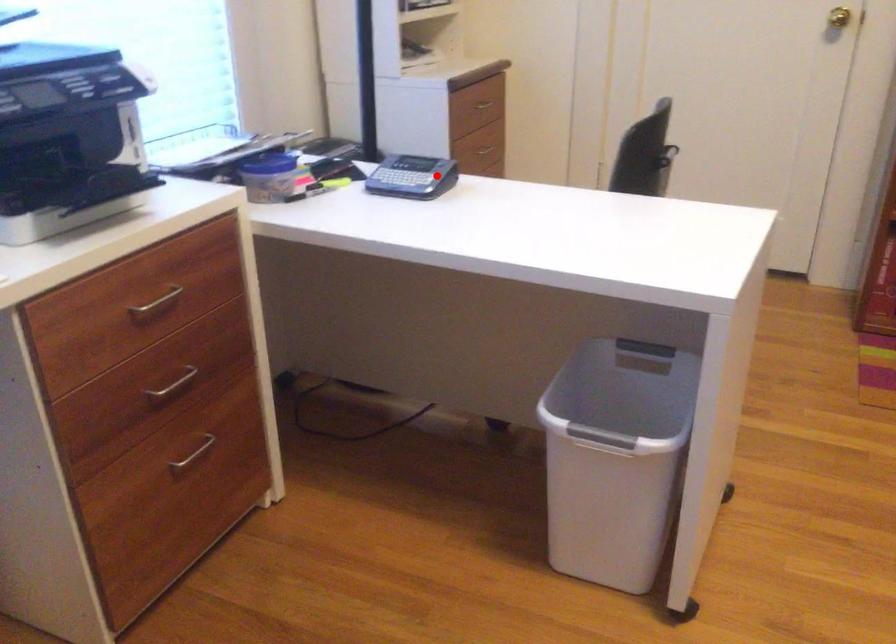
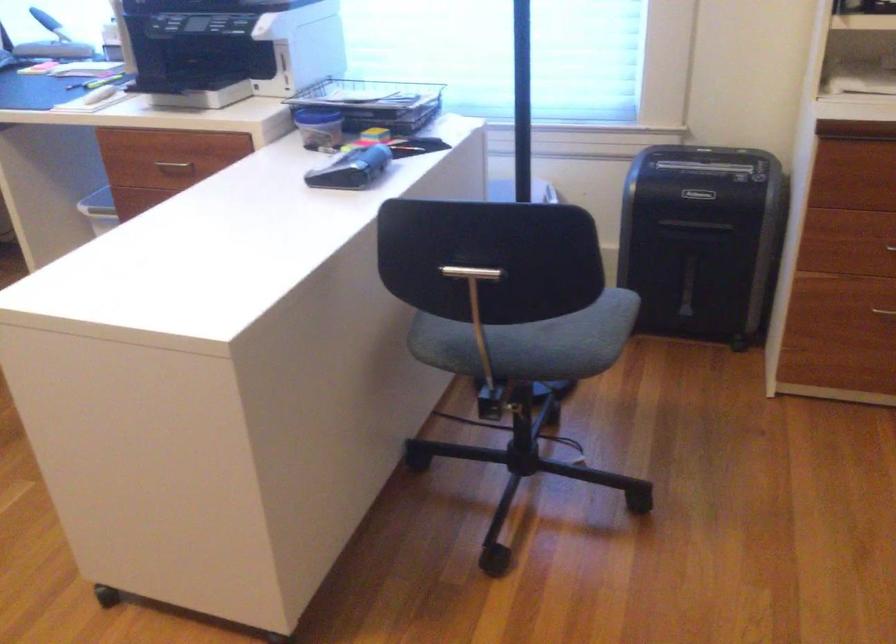
Find the pixel in the second image that matches the highlighted location in the first image.

(351, 169)